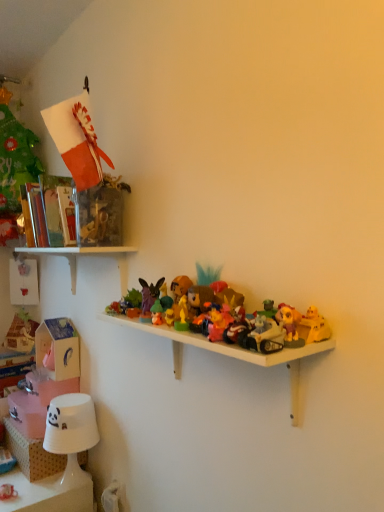
Locate an element on the screen. This screenshot has height=512, width=384. vacant area that lies between white paper lampshade at lower left and smooth white lampshade at lower left, which is counted as the eighth toy, starting from the front is located at coordinates point(28,497).